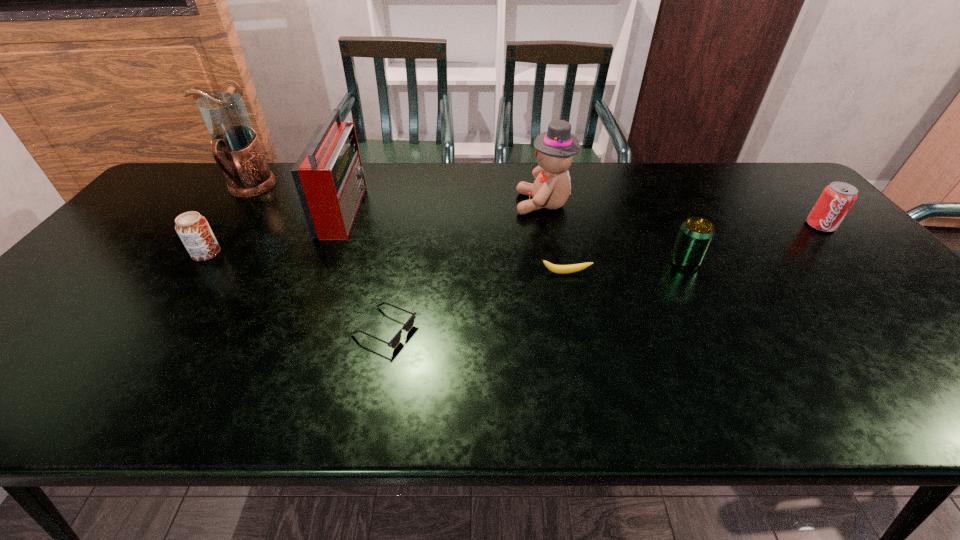
Locate an element on the screen. This screenshot has width=960, height=540. free spot located 0.170m on the front-facing side of the radio receiver is located at coordinates (418, 210).

Find the location of `free space located on the front-facing side of the rag_doll`. free space located on the front-facing side of the rag_doll is located at coordinates (480, 204).

This screenshot has height=540, width=960. Identify the location of vacant region located on the front-facing side of the rag_doll. (477, 204).

This screenshot has height=540, width=960. Identify the location of vacant area located on the front-facing side of the rag_doll. (454, 204).

Identify the location of free spot located on the back of the rightmost object. Image resolution: width=960 pixels, height=540 pixels. (779, 181).

Where is `vacant space located on the back of the left beer can`? The height and width of the screenshot is (540, 960). vacant space located on the back of the left beer can is located at coordinates (263, 173).

I want to click on vacant space located 0.270m on the right of the seventh object from left to right, so click(x=803, y=261).

Locate an element on the screen. This screenshot has width=960, height=540. vacant region located on the upward curve of the banana is located at coordinates click(x=587, y=370).

Find the location of a particular element. vacant position located 0.210m on the lenses of the sunglasses is located at coordinates (510, 329).

Where is `pitcher that is at the far edge`? This screenshot has width=960, height=540. pitcher that is at the far edge is located at coordinates (235, 146).